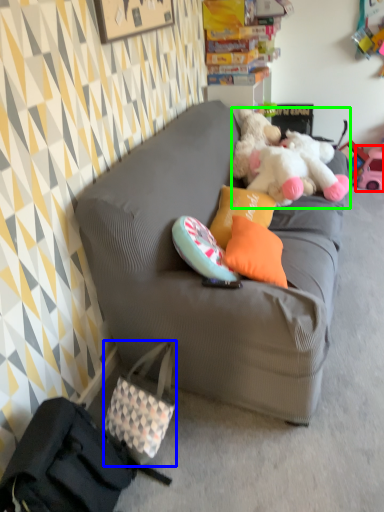
Question: Which is nearer to the toy (highlighted by a red box)? handbag (highlighted by a blue box) or teddy bear (highlighted by a green box).

Choices:
 (A) handbag
 (B) teddy bear

Answer: (B)